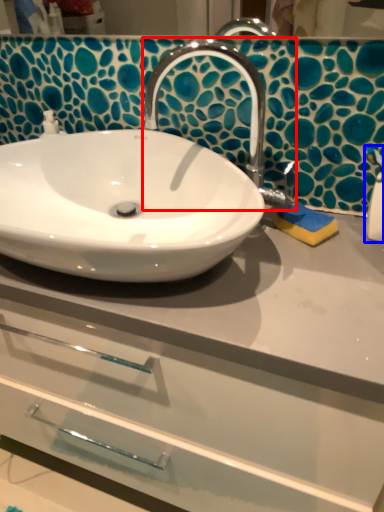
Question: Which of the following is the closest to the observer, tap (highlighted by a red box) or soap dispenser (highlighted by a blue box)?

Choices:
 (A) tap
 (B) soap dispenser

Answer: (A)